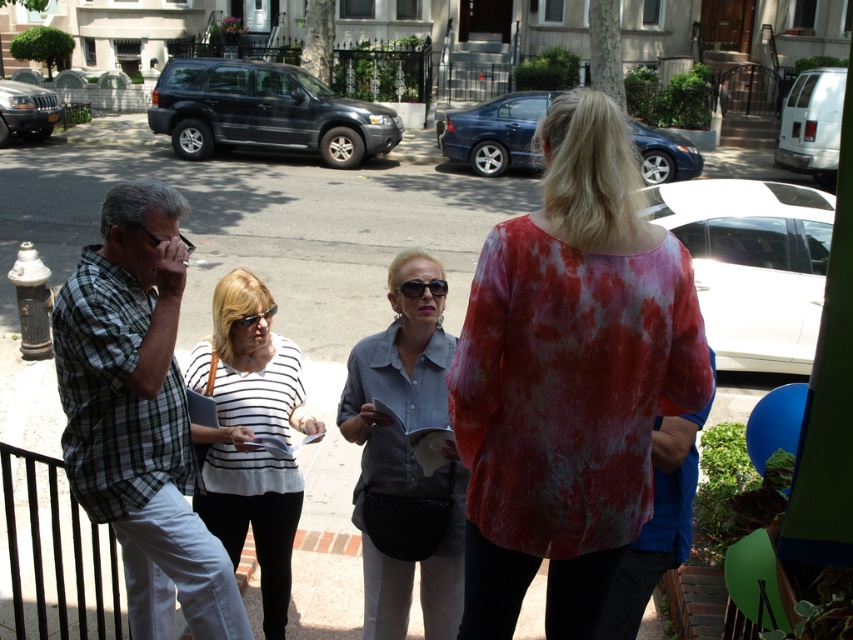
From the picture: Which is more to the left, matte gray shirt at center or white striped shirt at center?

Positioned to the left is white striped shirt at center.

Describe the element at coordinates (405, 449) in the screenshot. I see `matte gray shirt at center` at that location.

The height and width of the screenshot is (640, 853). Identify the location of matte gray shirt at center. (405, 449).

This screenshot has width=853, height=640. I want to click on red tie-dye blouse at center, so click(569, 378).

Does point (556, 465) come closer to viewer compared to point (296, 470)?

Yes, it is in front of point (296, 470).

Between point (521, 280) and point (289, 577), which one is positioned behind?

The point (289, 577) is more distant.

Locate an element on the screen. The height and width of the screenshot is (640, 853). red tie-dye blouse at center is located at coordinates (569, 378).

This screenshot has width=853, height=640. What do you see at coordinates (138, 413) in the screenshot? I see `plaid cotton shirt at left` at bounding box center [138, 413].

Does plaid cotton shirt at left appear on the right side of matte gray shirt at center?

No, plaid cotton shirt at left is not to the right of matte gray shirt at center.

The height and width of the screenshot is (640, 853). What are the coordinates of `plaid cotton shirt at left` in the screenshot? It's located at (138, 413).